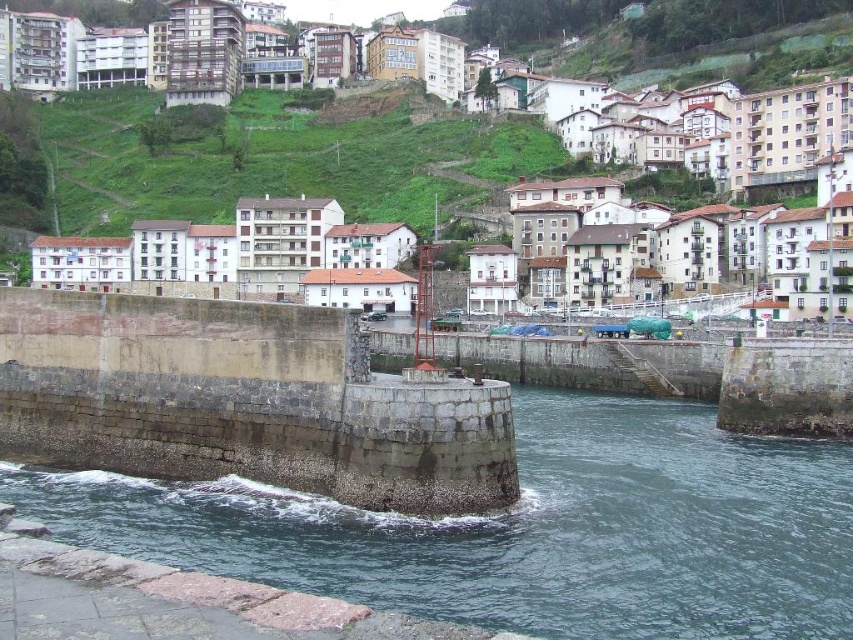
Based on the photo, is dark gray stone river at center above white stone buildings at center?

Incorrect, dark gray stone river at center is not positioned above white stone buildings at center.

Where is `dark gray stone river at center`? This screenshot has width=853, height=640. dark gray stone river at center is located at coordinates (527, 529).

Consider the image. Between dark gray stone river at center and green grassy hillside at upper center, which one appears on the left side from the viewer's perspective?

Positioned to the left is green grassy hillside at upper center.

Is dark gray stone river at center below green grassy hillside at upper center?

Indeed, dark gray stone river at center is positioned under green grassy hillside at upper center.

Find the location of `dark gray stone river at center`. dark gray stone river at center is located at coordinates (527, 529).

This screenshot has width=853, height=640. Find the location of `dark gray stone river at center`. dark gray stone river at center is located at coordinates (527, 529).

What do you see at coordinates (276, 157) in the screenshot?
I see `white stone buildings at center` at bounding box center [276, 157].

Where is `white stone buildings at center`? white stone buildings at center is located at coordinates (276, 157).

Identify the location of white stone buildings at center. click(x=276, y=157).